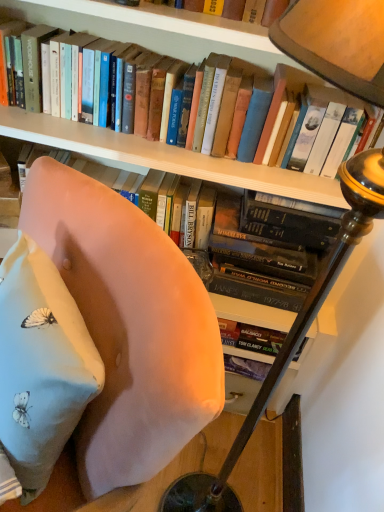
Question: Choose the correct answer: Is pink fabric chair at center inside light pink fabric pillow at lower left or outside it?

Choices:
 (A) inside
 (B) outside

Answer: (B)

Question: Considering the positions of point (127, 217) and point (19, 361), is point (127, 217) closer or farther from the camera than point (19, 361)?

Choices:
 (A) closer
 (B) farther

Answer: (B)

Question: Based on their relative distances, which object is farther from the wooden table lamp at upper right?

Choices:
 (A) hardcover book at upper center
 (B) light pink fabric pillow at lower left
 (C) pink fabric chair at center

Answer: (B)

Question: Which is nearer to the light pink fabric pillow at lower left?

Choices:
 (A) wooden table lamp at upper right
 (B) hardcover book at upper center
 (C) pink fabric chair at center

Answer: (C)